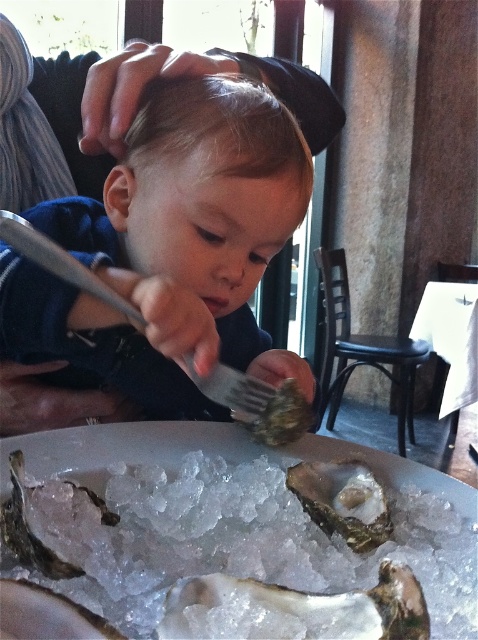
Question: Which of the following is the farthest from the observer?

Choices:
 (A) shiny pearl oyster at lower left
 (B) matte black shirt at center
 (C) white pearl oyster at center

Answer: (B)

Question: Which of these objects is positioned closest to the matte black shirt at center?

Choices:
 (A) translucent white shell at center
 (B) shiny pearl oyster at lower left

Answer: (A)

Question: Which object is the farthest from the silver metallic fork at center?

Choices:
 (A) shiny pearl oyster at lower left
 (B) shiny silver oyster at center
 (C) white pearl oyster at center

Answer: (A)

Question: Is white pearl oyster at center wider than shiny silver oyster at lower left?

Choices:
 (A) no
 (B) yes

Answer: (B)

Question: Does silver metallic fork at center have a larger size compared to shiny silver oyster at center?

Choices:
 (A) yes
 (B) no

Answer: (A)

Question: Observing the image, what is the correct spatial positioning of matte black shirt at center in reference to shiny silver oyster at center?

Choices:
 (A) below
 (B) above

Answer: (B)